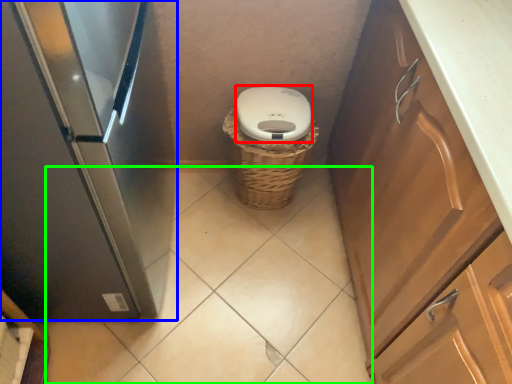
Question: Based on their relative distances, which object is nearer to toilet bowl (highlighted by a red box)? Choose from home appliance (highlighted by a blue box) and plain (highlighted by a green box).

Choices:
 (A) home appliance
 (B) plain

Answer: (A)